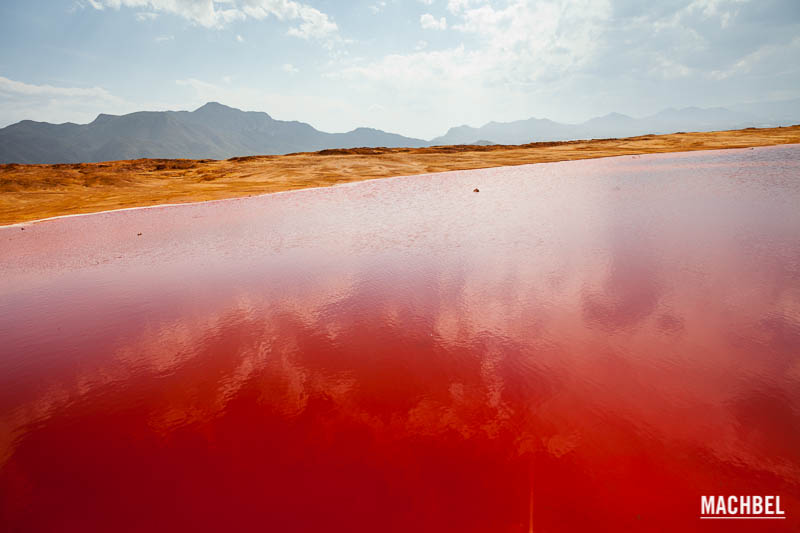
Locate an element on the screen. top left corner empty space is located at coordinates (5, 2).